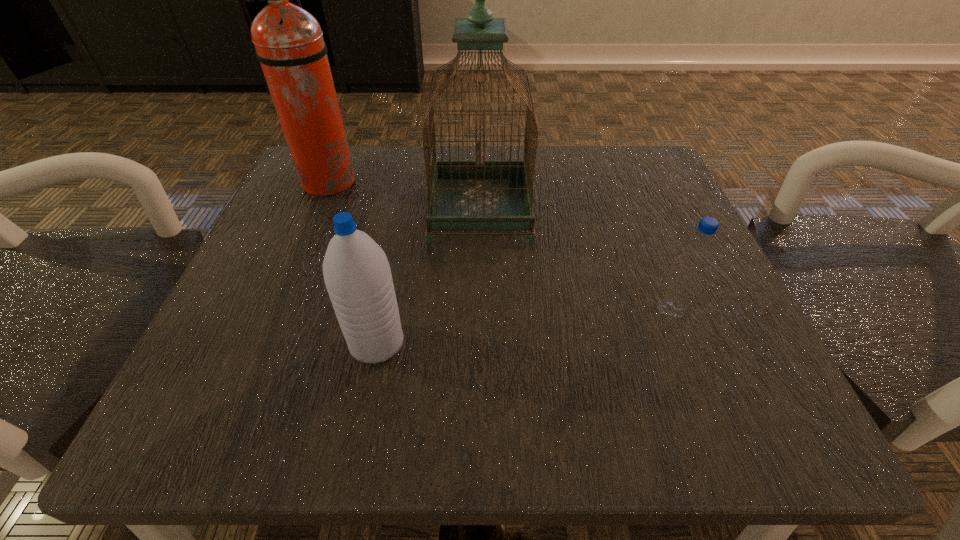
I want to click on vacant region at the near left corner, so click(x=229, y=408).

Locate an element on the screen. The image size is (960, 540). free region at the near right corner of the desktop is located at coordinates (718, 409).

The image size is (960, 540). I want to click on empty location between the third object from left to right and the leftmost object, so click(x=404, y=197).

Where is `vacant area that lies between the leftmost object and the shorter water bottle`? The width and height of the screenshot is (960, 540). vacant area that lies between the leftmost object and the shorter water bottle is located at coordinates (498, 246).

Identify the location of free space between the shortest object and the fire extinguisher. The height and width of the screenshot is (540, 960). (498, 246).

Locate an element on the screen. The image size is (960, 540). free space between the birdcage and the rightmost object is located at coordinates (575, 260).

You are a GUI agent. You are given a task and a screenshot of the screen. Output one action in this format:
    pyautogui.click(x=<x>, y=<y>)
    Task: Click on the empty space that is in between the third object from left to right and the rightmost object
    The image size is (960, 540).
    Given the screenshot: What is the action you would take?
    pyautogui.click(x=575, y=260)

I want to click on empty location between the fire extinguisher and the shortest object, so click(498, 246).

Locate an element on the screen. Image resolution: width=960 pixels, height=540 pixels. vacant region between the taller water bottle and the right water bottle is located at coordinates (523, 327).

The height and width of the screenshot is (540, 960). Find the location of `free space between the leftmost object and the birdcage`. free space between the leftmost object and the birdcage is located at coordinates (404, 197).